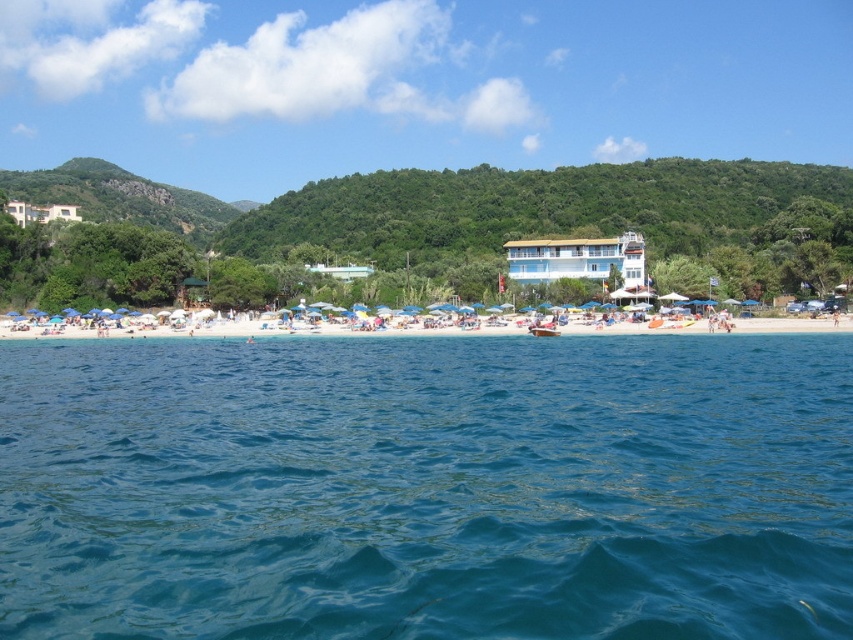
Question: Which of the following is the farthest from the observer?

Choices:
 (A) (13, 554)
 (B) (73, 212)
 (C) (625, 260)

Answer: (B)

Question: Is blue liquid water at center wider than white glossy building at upper left?

Choices:
 (A) yes
 (B) no

Answer: (A)

Question: Which object is the closest to the white glossy building at upper left?

Choices:
 (A) blue liquid water at center
 (B) wooden boat at center

Answer: (A)

Question: Is white sand beach at center behind white glossy building at upper left?

Choices:
 (A) yes
 (B) no

Answer: (B)

Question: Can you confirm if white sand beach at center is positioned to the left of white glossy building at upper left?

Choices:
 (A) no
 (B) yes

Answer: (A)

Question: Which is nearer to the wooden boat at center?

Choices:
 (A) white glossy building at upper left
 (B) white glossy building at center
 (C) white sand beach at center

Answer: (C)